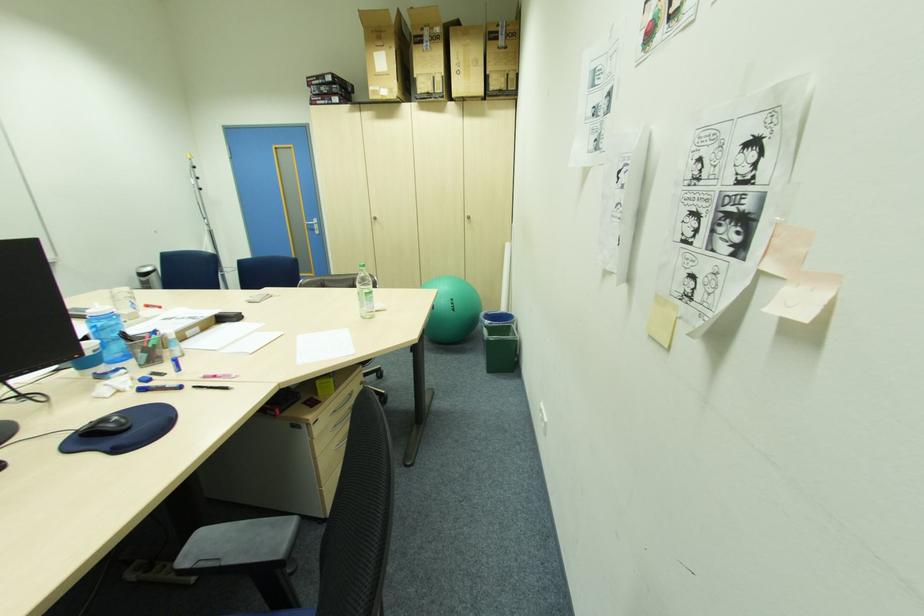
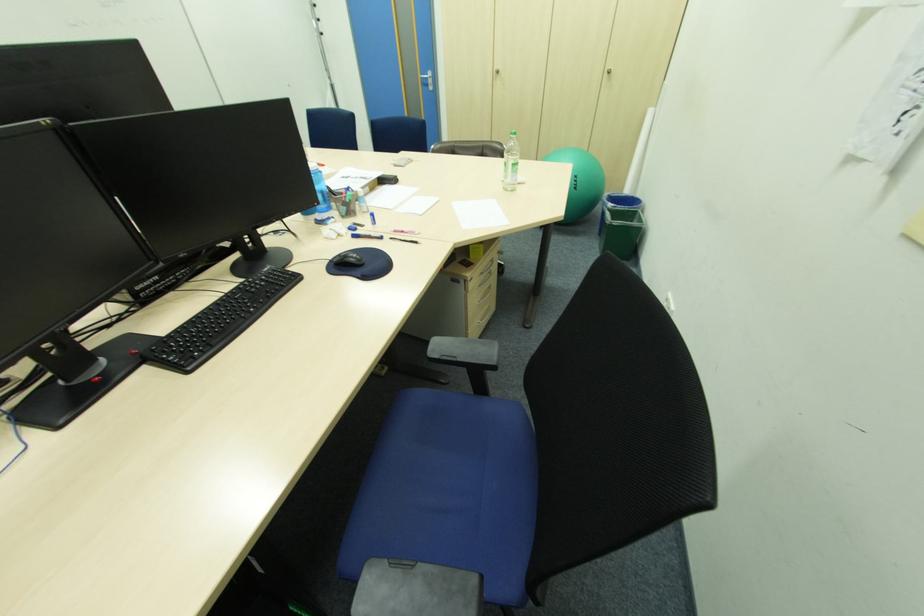
Question: I am providing you with two images of the same scene from different viewpoints. After the viewpoint changes to image2, which objects are now occluded?

Choices:
 (A) black marker
 (B) blue pen
 (C) green trash can
 (D) none of these

Answer: (D)